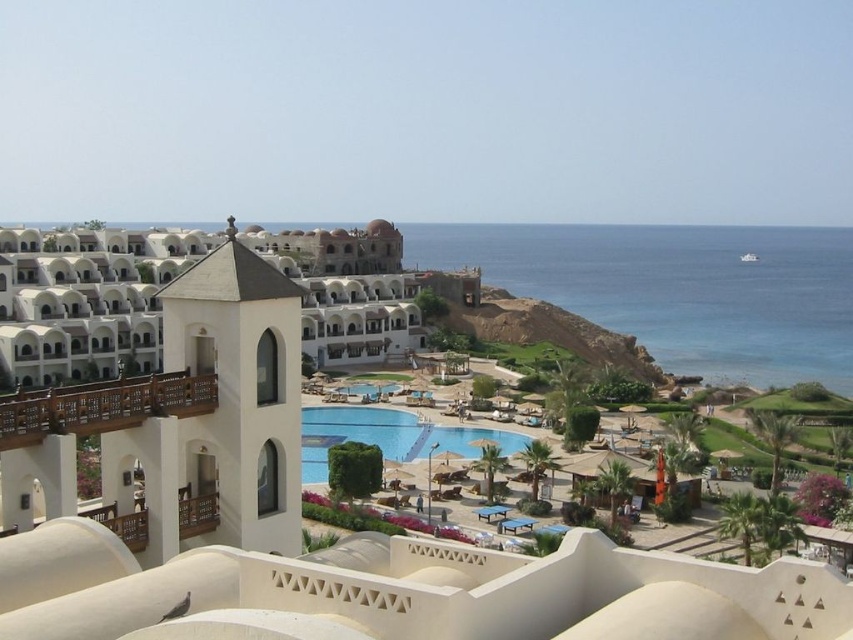
Does white matte building at center have a greater height compared to wooden balcony at upper left?

Indeed, white matte building at center has a greater height compared to wooden balcony at upper left.

Between point (230, 490) and point (55, 422), which one is positioned in front?

Positioned in front is point (55, 422).

Identify the location of white matte building at center. Image resolution: width=853 pixels, height=640 pixels. (329, 548).

Describe the element at coordinates (329, 548) in the screenshot. I see `white matte building at center` at that location.

The image size is (853, 640). Find the location of `white matte building at center`. white matte building at center is located at coordinates tap(329, 548).

Who is lower down, wooden balcony at upper left or blue glossy pool at center?

blue glossy pool at center

Is wooden balcony at upper left taller than blue glossy pool at center?

No, wooden balcony at upper left is not taller than blue glossy pool at center.

At what (x,y) coordinates should I click in order to perform the action: click on wooden balcony at upper left. Please return your answer as a coordinate pair (x, y). This screenshot has height=640, width=853. Looking at the image, I should click on (102, 404).